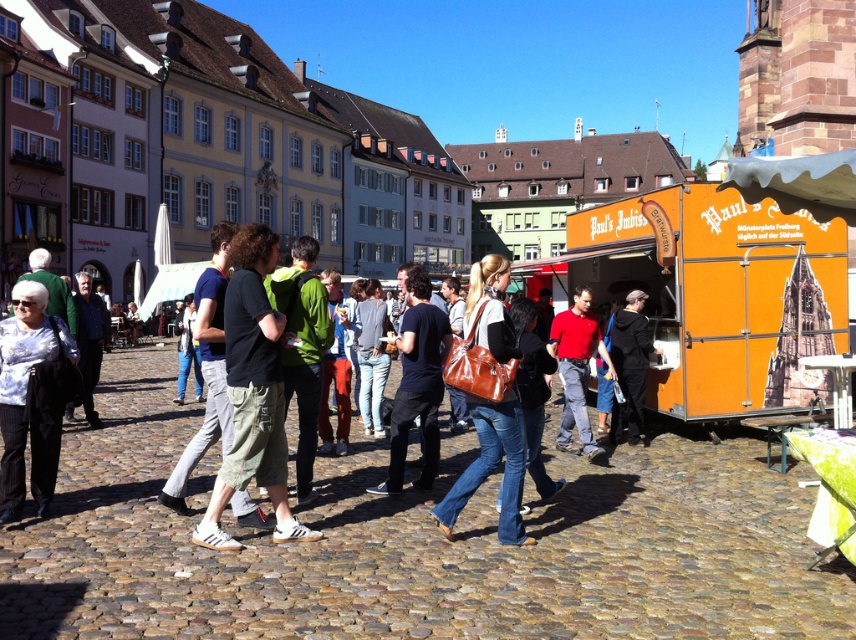
From the picture: Can you confirm if green cargo shorts at center is smaller than brown leather bag at center?

Incorrect, green cargo shorts at center is not smaller in size than brown leather bag at center.

Who is positioned more to the right, green cargo shorts at center or brown leather bag at center?

From the viewer's perspective, brown leather bag at center appears more on the right side.

Between point (254, 246) and point (479, 298), which one is positioned behind?

The point (479, 298) is more distant.

Locate an element on the screen. green cargo shorts at center is located at coordinates (253, 392).

Who is shorter, orange matte food truck at center or black leather jacket at center?

orange matte food truck at center

Looking at this image, does orange matte food truck at center have a greater height compared to black leather jacket at center?

In fact, orange matte food truck at center may be shorter than black leather jacket at center.

I want to click on orange matte food truck at center, so click(x=716, y=292).

Does white matte shirt at lower left have a larger size compared to black matte shirt at center?

Actually, white matte shirt at lower left might be smaller than black matte shirt at center.

Between white matte shirt at lower left and black matte shirt at center, which one is positioned lower?

black matte shirt at center

What are the coordinates of `white matte shirt at lower left` in the screenshot? It's located at (25, 397).

Locate an element on the screen. Image resolution: width=856 pixels, height=640 pixels. white matte shirt at lower left is located at coordinates click(x=25, y=397).